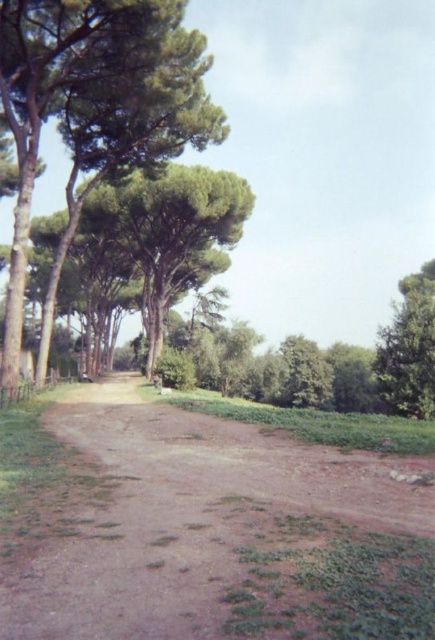
Question: Considering the real-world distances, which object is farthest from the green leafy tree at right?

Choices:
 (A) brown dirt track at center
 (B) green leafy tree at left

Answer: (A)

Question: Is green leafy tree at left thinner than green leafy tree at right?

Choices:
 (A) no
 (B) yes

Answer: (A)

Question: Which of these objects is positioned farthest from the green leafy tree at left?

Choices:
 (A) brown dirt track at center
 (B) green leafy tree at right

Answer: (B)

Question: Among these points, which one is nearest to the camera?

Choices:
 (A) (431, 310)
 (B) (0, 29)

Answer: (B)

Question: Can you confirm if brown dirt track at center is bigger than green leafy tree at left?

Choices:
 (A) no
 (B) yes

Answer: (A)

Question: Where is green leafy tree at left located in relation to green leafy tree at right in the image?

Choices:
 (A) left
 (B) right

Answer: (A)